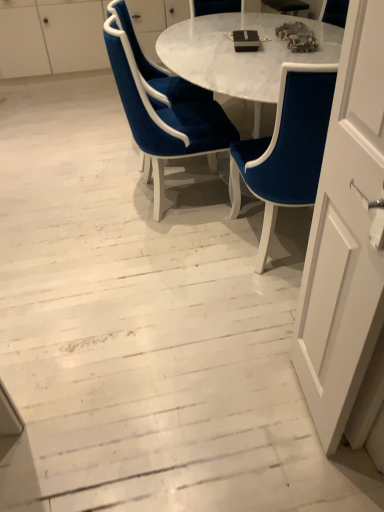
Where is `vacant space that is in between velvet blue chair at center, which appears as the 2th chair when viewed from the left, and velvet blue chair at center, arranged as the 3th chair when viewed from the right`? This screenshot has width=384, height=512. vacant space that is in between velvet blue chair at center, which appears as the 2th chair when viewed from the left, and velvet blue chair at center, arranged as the 3th chair when viewed from the right is located at coordinates click(172, 172).